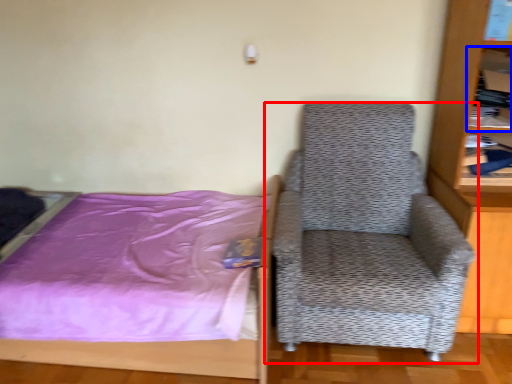
Question: Among these objects, which one is nearest to the camera, chair (highlighted by a red box) or shelf (highlighted by a blue box)?

Choices:
 (A) chair
 (B) shelf

Answer: (A)